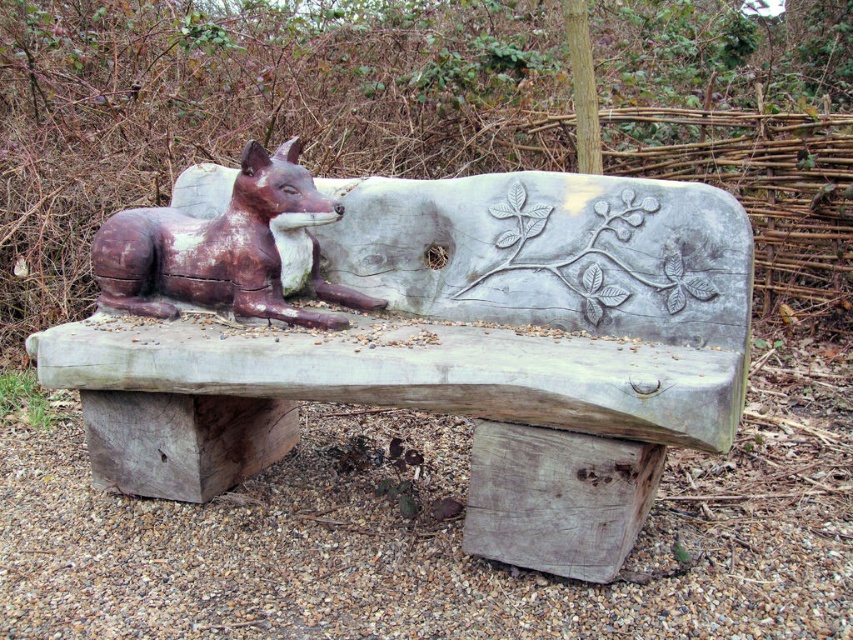
Can you confirm if wooden bench with carved fox at center is positioned below rustic wooden fox at center?

Yes, wooden bench with carved fox at center is below rustic wooden fox at center.

Who is positioned more to the left, wooden bench with carved fox at center or rustic wooden fox at center?

rustic wooden fox at center is more to the left.

Is point (189, 472) behind point (325, 282)?

No, it is in front of (325, 282).

Locate an element on the screen. wooden bench with carved fox at center is located at coordinates (451, 349).